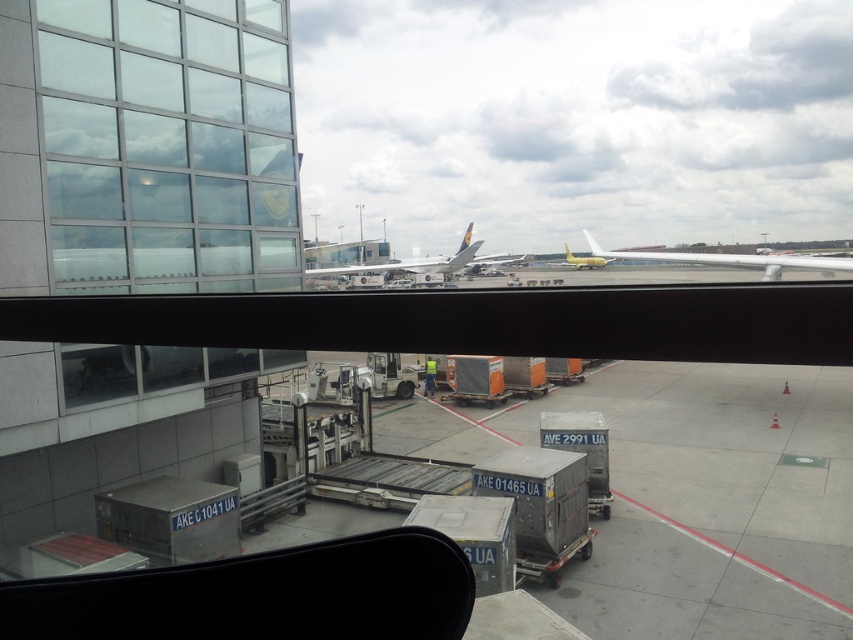
Question: Does yellow matte airplane at center appear on the right side of white glossy airplane at center?

Choices:
 (A) yes
 (B) no

Answer: (A)

Question: Which point appears closest to the camera in this image?

Choices:
 (A) (706, 257)
 (B) (577, 260)

Answer: (A)

Question: Is white glossy airplane at center closer to the viewer compared to gold metallic airplane at center?

Choices:
 (A) yes
 (B) no

Answer: (A)

Question: Does transparent glass window at upper left appear on the left side of yellow matte airplane at center?

Choices:
 (A) yes
 (B) no

Answer: (A)

Question: Which object is farther from the camera taking this photo?

Choices:
 (A) white glossy airplane at center
 (B) transparent glass window at upper left
 (C) gold metallic airplane at center
 (D) yellow matte airplane at center

Answer: (C)

Question: Which of these objects is positioned closest to the gold metallic airplane at center?

Choices:
 (A) yellow matte airplane at center
 (B) white glossy airplane at center

Answer: (A)